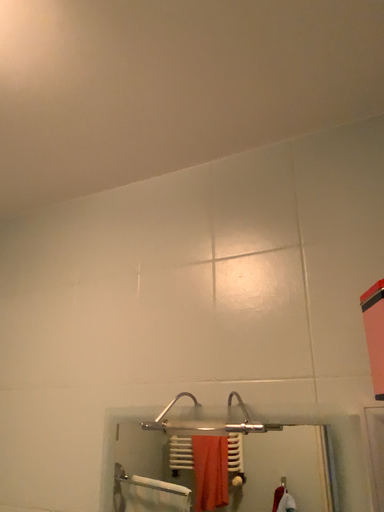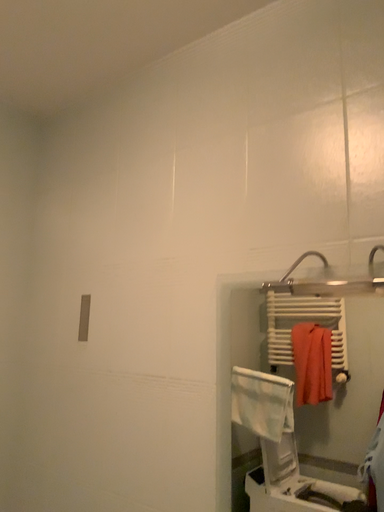
Question: Which way did the camera rotate in the video?

Choices:
 (A) rotated right
 (B) rotated left

Answer: (B)